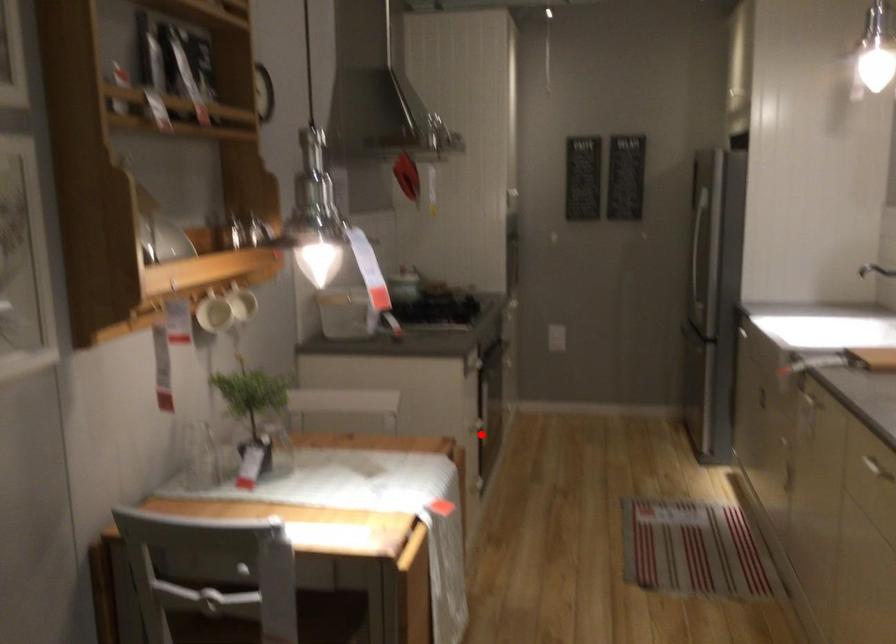
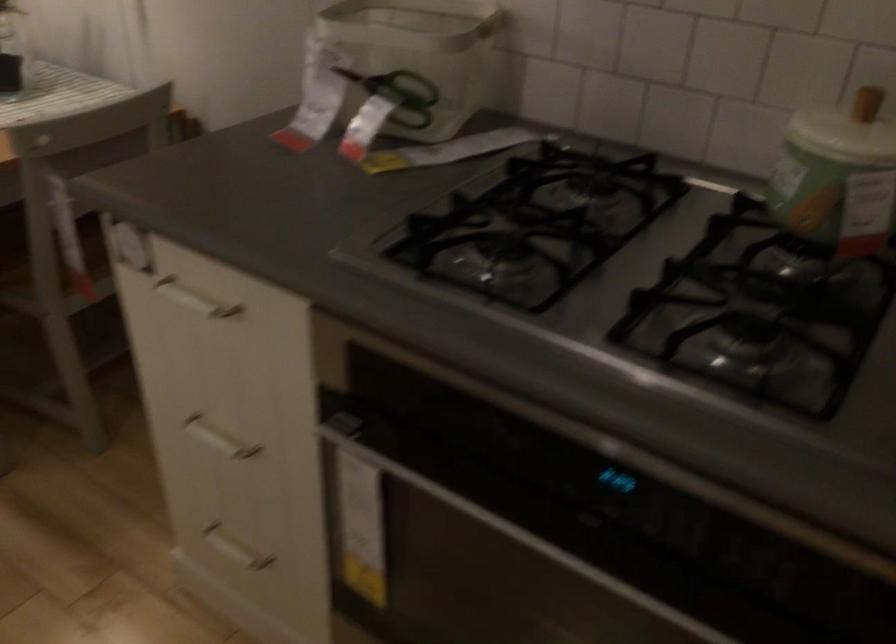
Locate, in the second image, the point that corresponds to the highlighted location in the first image.

(218, 438)